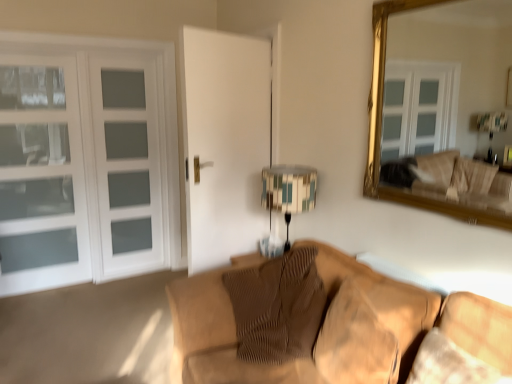
Identify the location of vacant area on top of white glass door at left (from a real-world perspective). The image size is (512, 384). (86, 60).